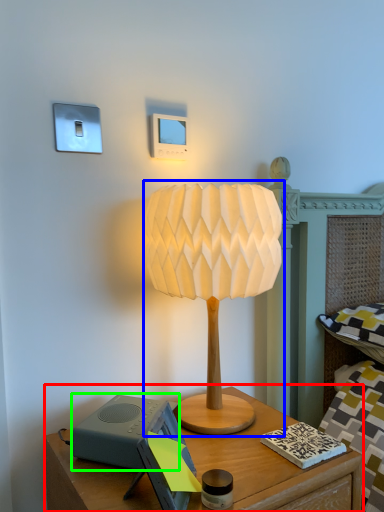
Question: Based on their relative distances, which object is farther from nightstand (highlighted by a red box)? Choose from lamp (highlighted by a blue box) and speaker (highlighted by a green box).

Choices:
 (A) lamp
 (B) speaker

Answer: (A)